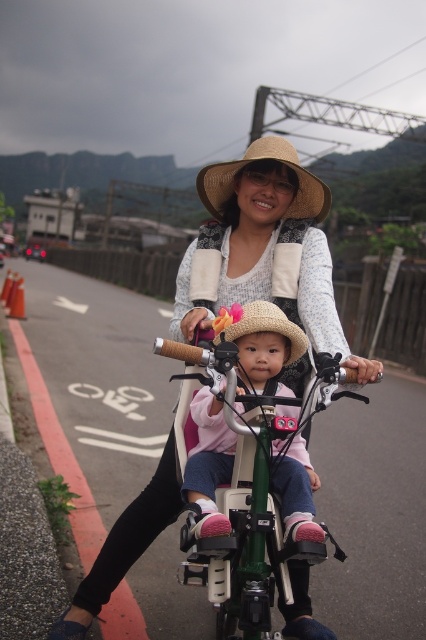
You are a delivery person who needs to place a small package between the matte straw hat at center and the green matte bicycle at center. The package requires a minimum of 5 feet of space to be placed safely. Can you fit the package between them?

The distance between the matte straw hat at center and the green matte bicycle at center is 4.54 feet, which is less than the required 5 feet. Therefore, the package cannot be safely placed between them.

You are standing on the road where the woman and child are riding their bicycle. You want to place a small flag at the point that is closer to you. Which point should you choose between point (307, 188) and point (267, 634)?

Point (267, 634) is closer to you than point (307, 188), so you should place the flag at point (267, 634).